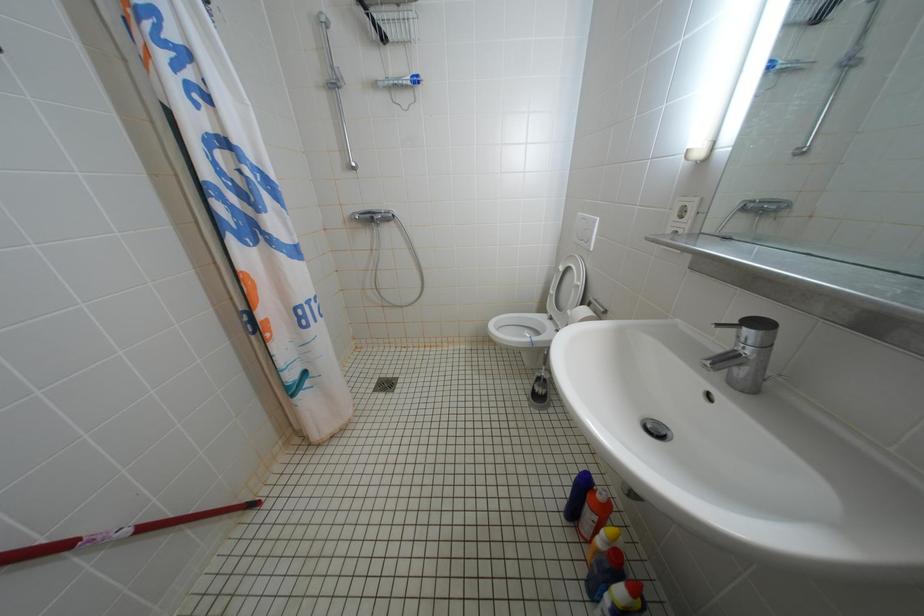
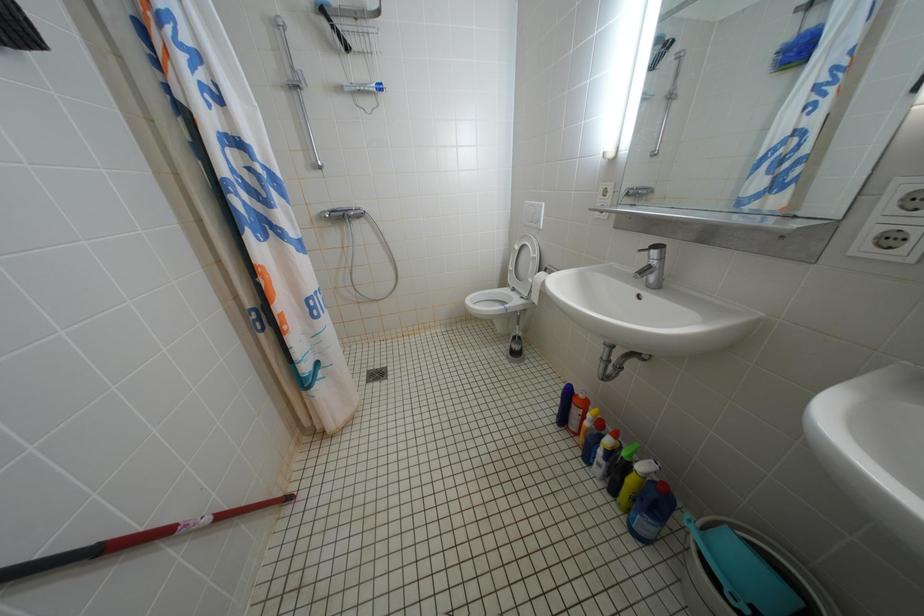
Question: Based on the continuous images, in which direction is the camera rotating? Reply with the corresponding letter.

Choices:
 (A) Left
 (B) Right
 (C) Up
 (D) Down

Answer: (B)